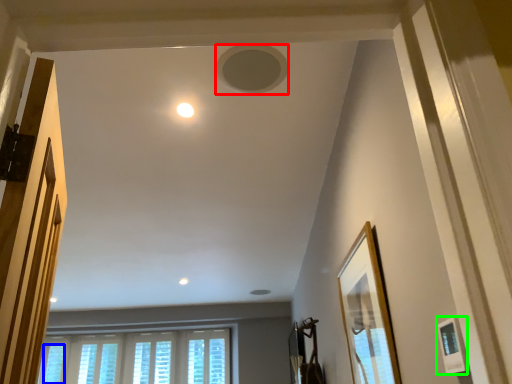
Question: Considering the real-world distances, which object is closest to hole (highlighted by a red box)? window (highlighted by a blue box) or picture frame (highlighted by a green box).

Choices:
 (A) window
 (B) picture frame

Answer: (B)